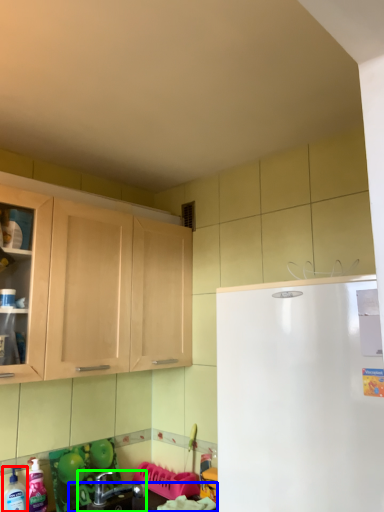
Question: Considering the real-world distances, which object is farthest from cleaning product (highlighted by a red box)? counter top (highlighted by a blue box) or sink (highlighted by a green box)?

Choices:
 (A) counter top
 (B) sink

Answer: (A)